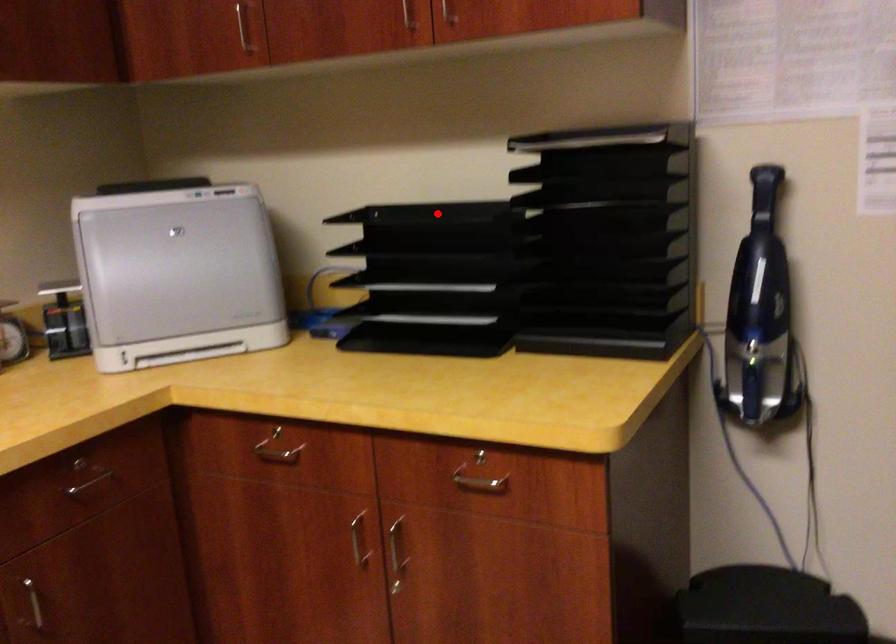
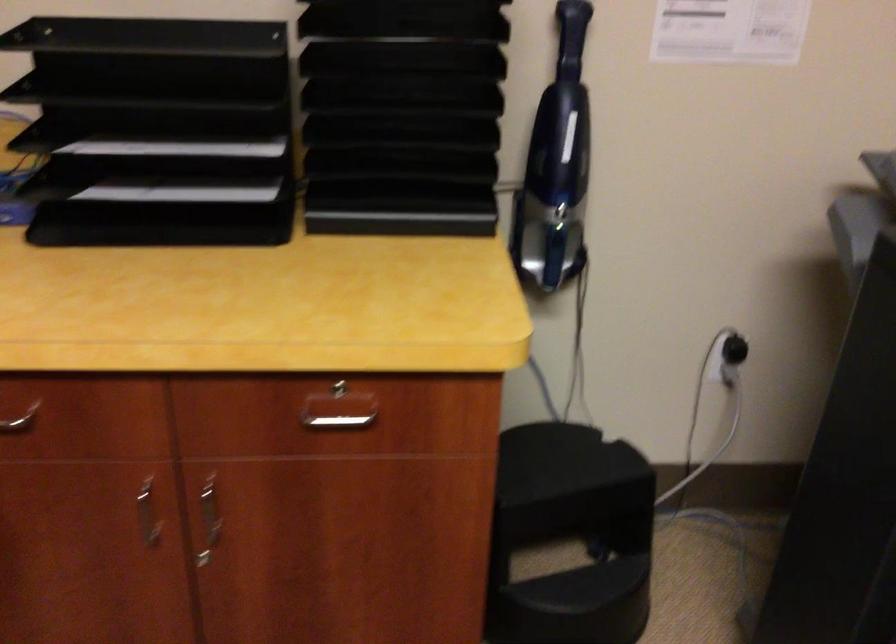
Question: I am providing you with two images of the same scene from different viewpoints. Given a red point in image1, look at the same physical point in image2. Is it:

Choices:
 (A) Closer to the viewpoint
 (B) Farther from the viewpoint

Answer: (A)